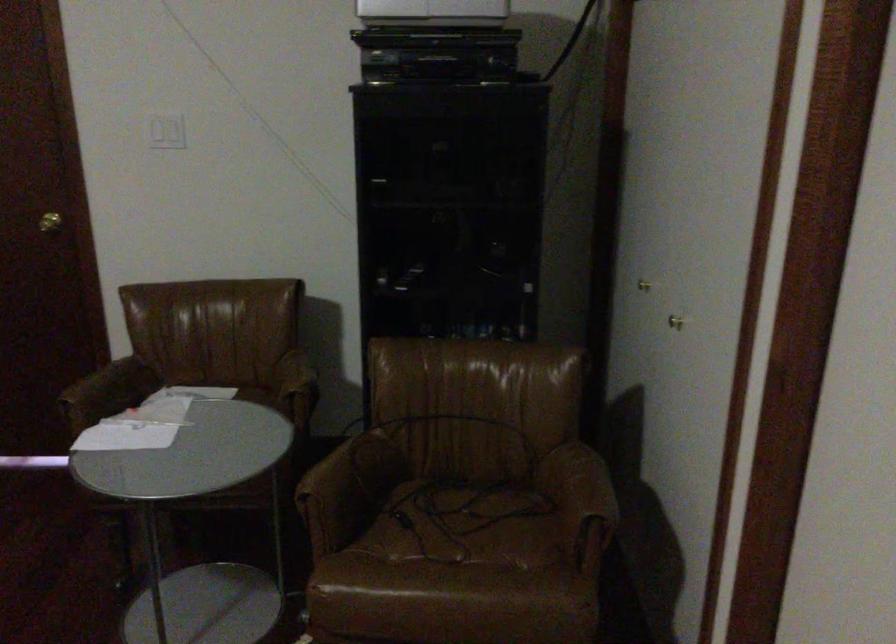
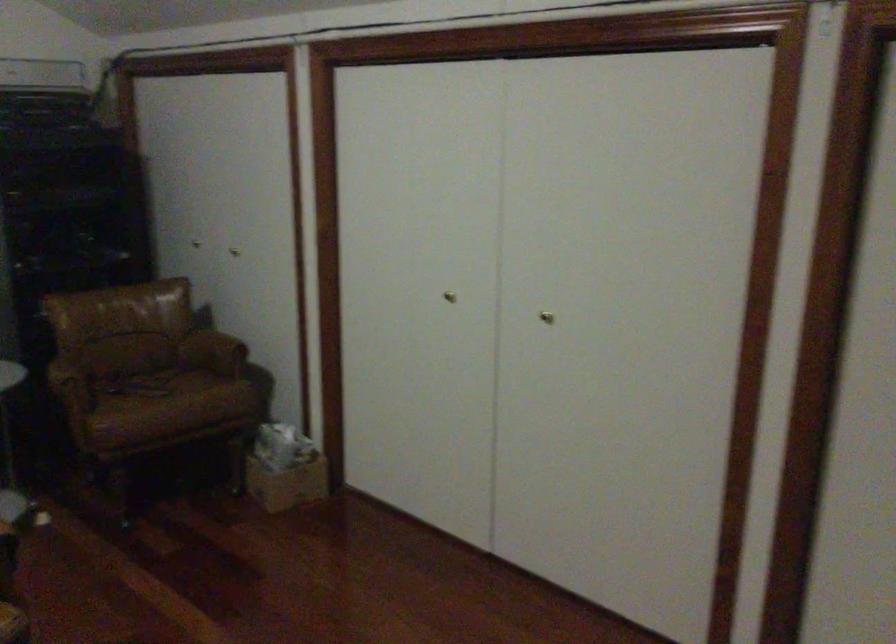
Question: I am providing you with two images of the same scene from different viewpoints. After the viewpoint changes to image2, which objects are now occluded?

Choices:
 (A) gold closet knob
 (B) cardboard box
 (C) chair sitting surface
 (D) none of these

Answer: (D)